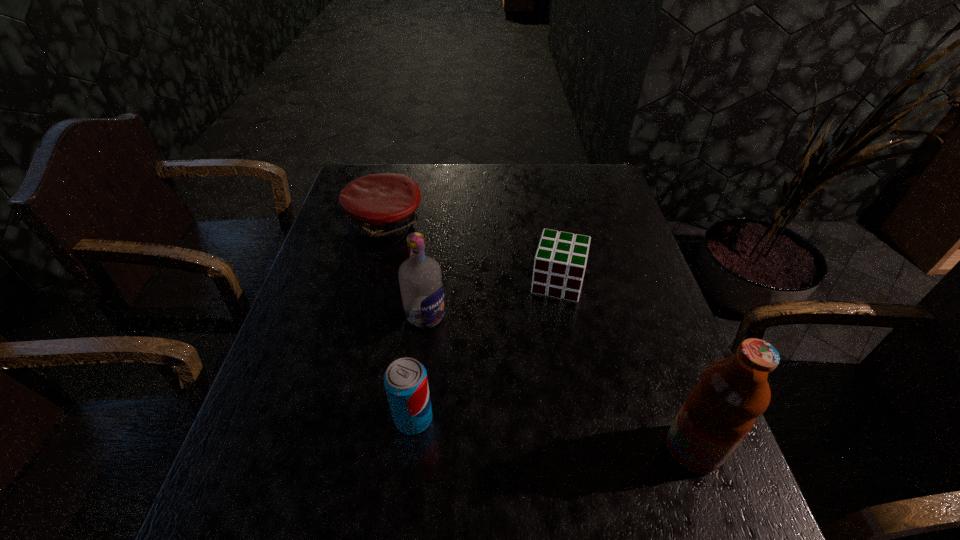
The height and width of the screenshot is (540, 960). I want to click on vacant space on the desktop that is between the soda can and the tallest object and is positioned at the front of the farthest object where the visor is located, so click(588, 437).

Where is `vacant space on the desktop that is between the soda can and the fruit juice and is positioned on the label of the vodka`? This screenshot has height=540, width=960. vacant space on the desktop that is between the soda can and the fruit juice and is positioned on the label of the vodka is located at coordinates (575, 436).

Where is `vacant space on the desktop that is between the soda can and the fruit juice and is positioned on the red face of the fourth object from left to right`? vacant space on the desktop that is between the soda can and the fruit juice and is positioned on the red face of the fourth object from left to right is located at coordinates (523, 430).